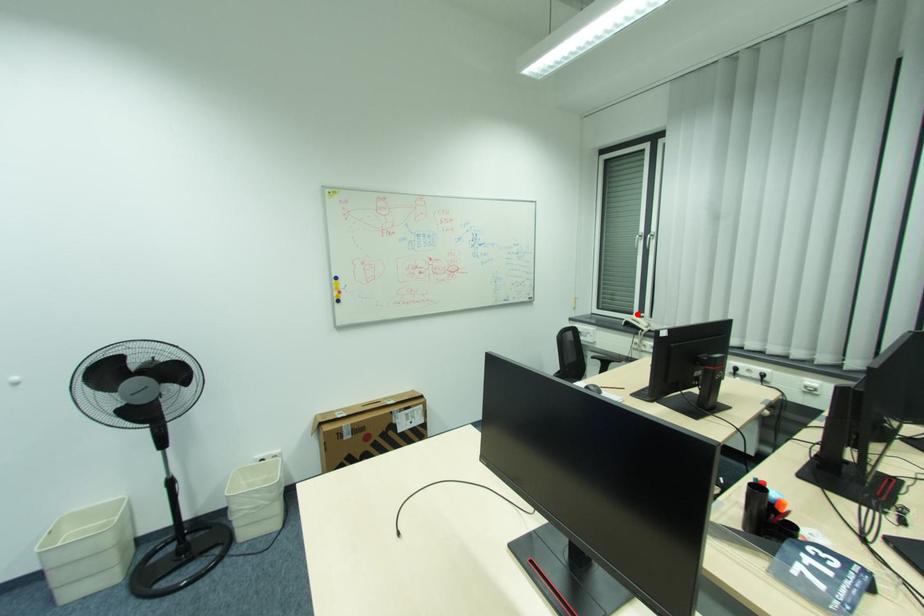
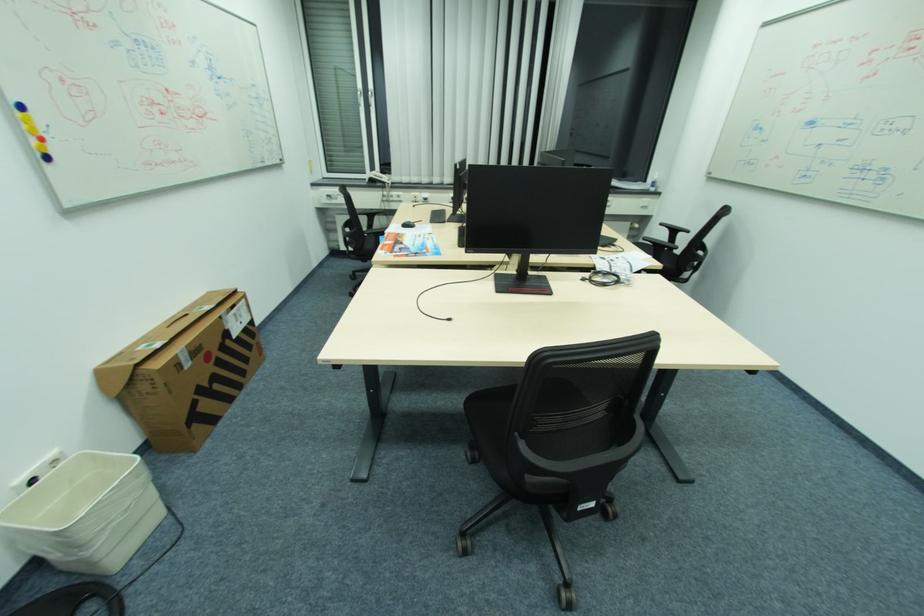
The point at the highlighted location is marked in the first image. Where is the corresponding point in the second image?

(370, 174)